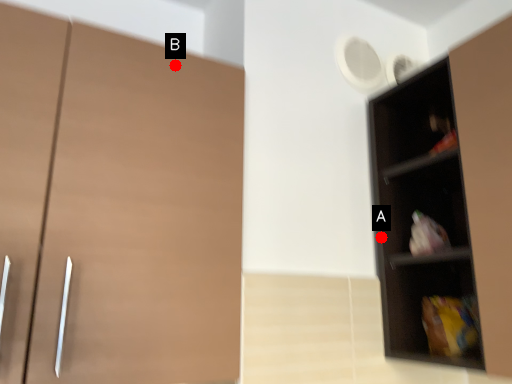
Question: Two points are circled on the image, labeled by A and B beside each circle. Which of the following is the closest to the observer?

Choices:
 (A) A is closer
 (B) B is closer

Answer: (B)